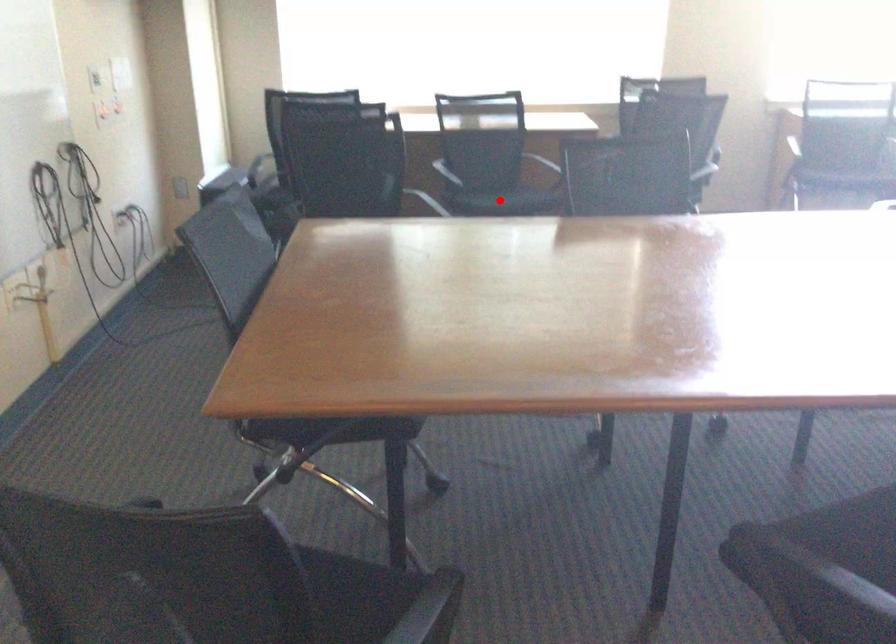
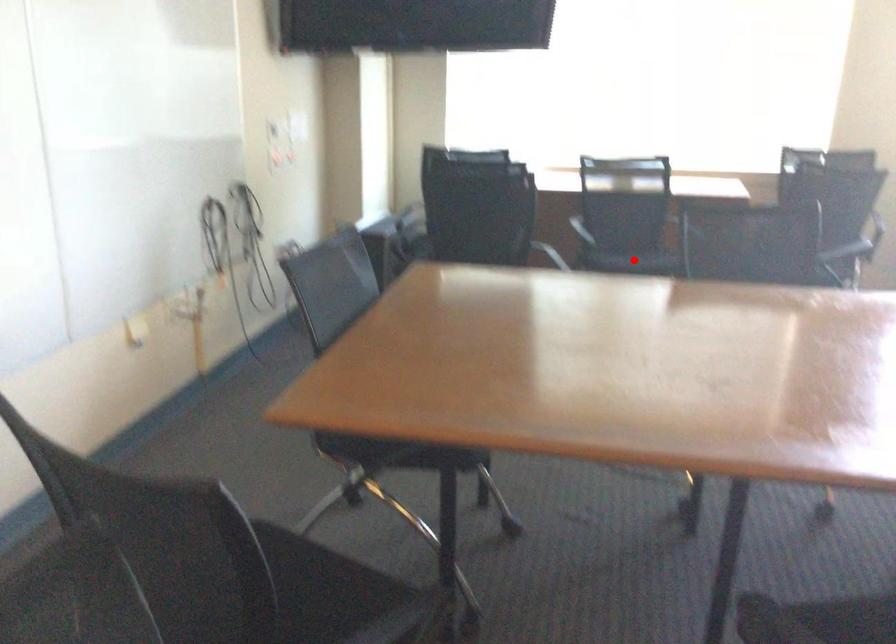
I am providing you with two images of the same scene from different viewpoints. A red point is marked on the first image and another point is marked on the second image. Does the point marked in image1 correspond to the same location as the one in image2?

Yes